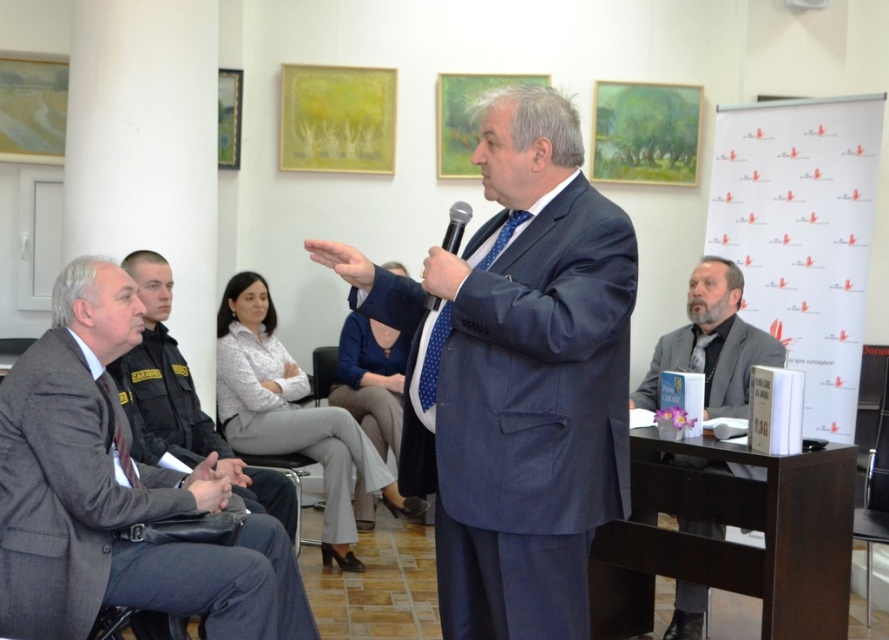
Can you confirm if gray woolen jacket at lower right is positioned to the right of black plastic microphone at center?

Yes, gray woolen jacket at lower right is to the right of black plastic microphone at center.

Which is more to the right, gray woolen jacket at lower right or black plastic microphone at center?

gray woolen jacket at lower right

Is point (719, 406) less distant than point (431, 301)?

No, it is behind (431, 301).

Find the location of a particular element. gray woolen jacket at lower right is located at coordinates (711, 342).

Based on the photo, can you confirm if blue textured suit at center is shorter than gray woolen jacket at lower right?

Incorrect, blue textured suit at center's height does not fall short of gray woolen jacket at lower right's.

Describe the element at coordinates (517, 376) in the screenshot. I see `blue textured suit at center` at that location.

Is point (454, 477) farther from viewer compared to point (671, 614)?

No.

This screenshot has height=640, width=889. I want to click on blue textured suit at center, so click(517, 376).

Is dark gray suit at left closer to camera compared to black plastic microphone at center?

No, dark gray suit at left is behind black plastic microphone at center.

Is dark gray suit at left thinner than black plastic microphone at center?

→ No.

Image resolution: width=889 pixels, height=640 pixels. What are the coordinates of `dark gray suit at left` in the screenshot? It's located at point(182,401).

The height and width of the screenshot is (640, 889). Identify the location of dark gray suit at left. (182, 401).